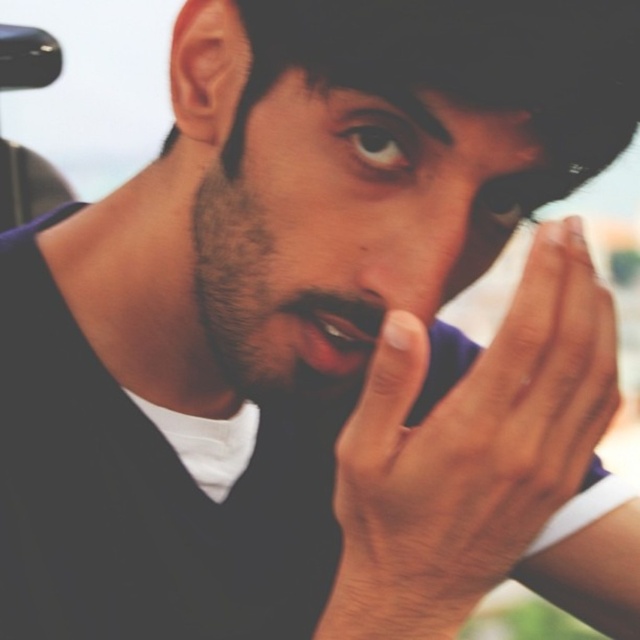
Question: Can you confirm if dry skin hand at center is positioned below smooth skin face at center?

Choices:
 (A) yes
 (B) no

Answer: (A)

Question: Which point appears farthest from the camera in this image?

Choices:
 (A) (346, 310)
 (B) (492, 456)
 (C) (456, 234)

Answer: (A)

Question: Which of these objects is positioned farthest from the smooth skin nose at center?

Choices:
 (A) smooth skin face at center
 (B) dry skin hand at center

Answer: (B)

Question: Is dry skin hand at center positioned in front of smooth skin face at center?

Choices:
 (A) yes
 (B) no

Answer: (A)

Question: Observing the image, what is the correct spatial positioning of dry skin hand at center in reference to smooth skin face at center?

Choices:
 (A) right
 (B) left

Answer: (A)

Question: Which point appears closest to the camera in this image?

Choices:
 (A) (406, 220)
 (B) (454, 504)
 (C) (436, 268)
 (D) (348, 330)

Answer: (B)